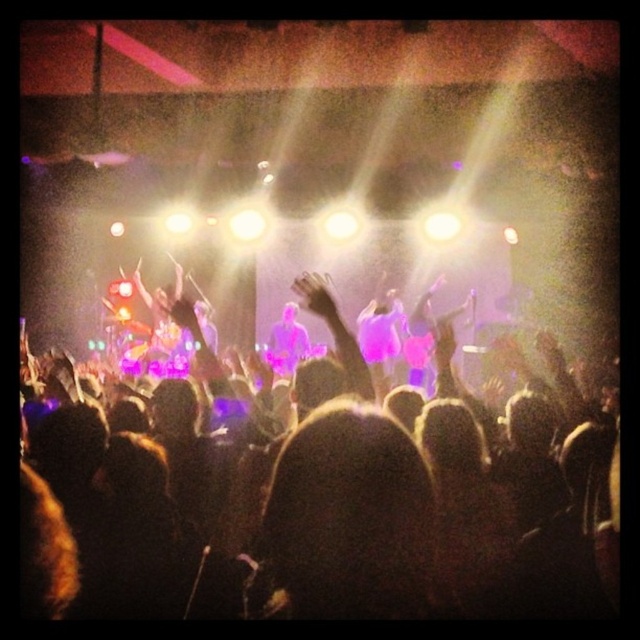
You are a photographer at the concert and want to capture the silhouette of person at center. Where should you position your camera to ensure the silhouette is in the center of your photo?

The silhouette of person at center is located at point coordinates (333,513), so you should position your camera so that the center of your photo aligns with those coordinates to capture the silhouette of person at center in the center of your photo.

You are a photographer at the concert and want to capture the silhouette of person at center and dark hair at center in a single frame. Since your camera has a fixed focus, you need to know which object is wider to adjust the lens properly. Which one is wider?

The silhouette of person at center is wider than the dark hair at center.

You are a photographer at the concert and want to capture the silhouette of person at center and dark hair at center in a single frame. Since the camera has a fixed focus, you need to adjust your position so that both are in focus. Which object should you move closer to ensure both are in focus?

The silhouette of person at center is much taller than dark hair at center, so you should move closer to the silhouette of person at center to ensure both are in focus.